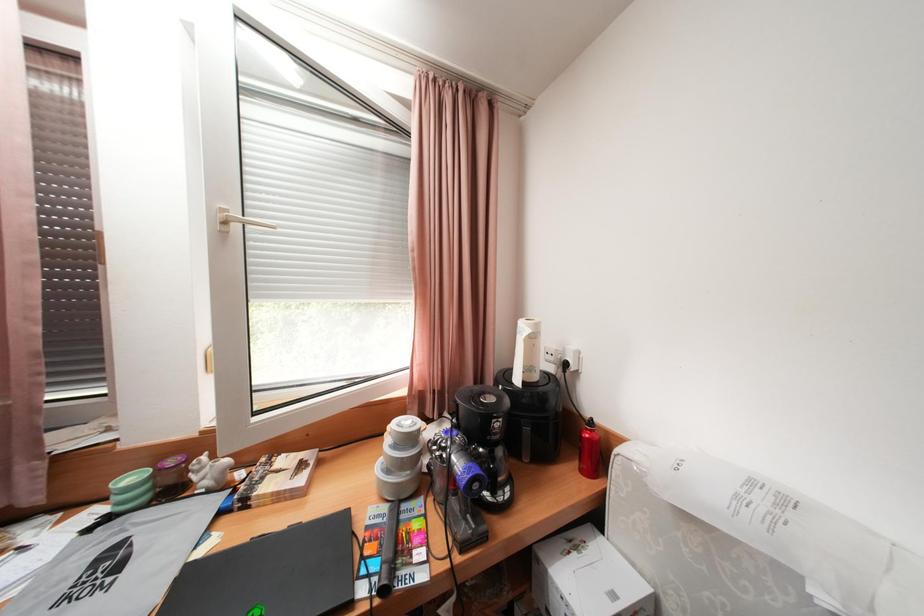
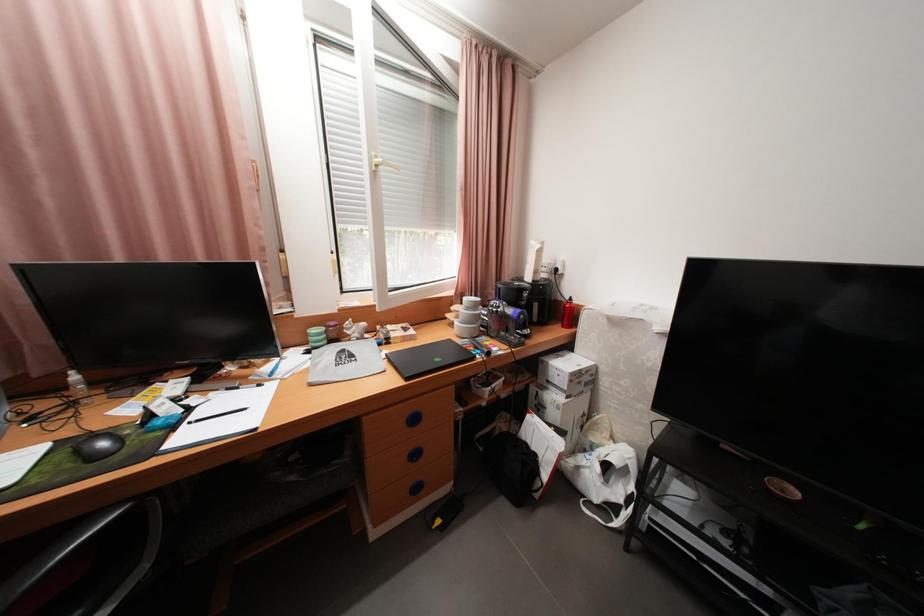
Question: The images are taken continuously from a first-person perspective. In which direction is your viewpoint rotating?

Choices:
 (A) Left
 (B) Right
 (C) Up
 (D) Down

Answer: (D)